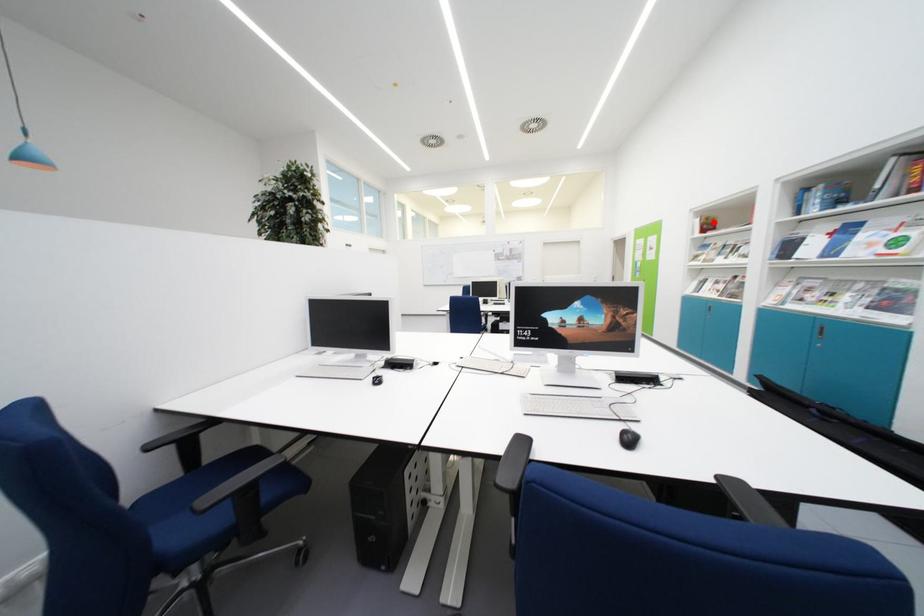
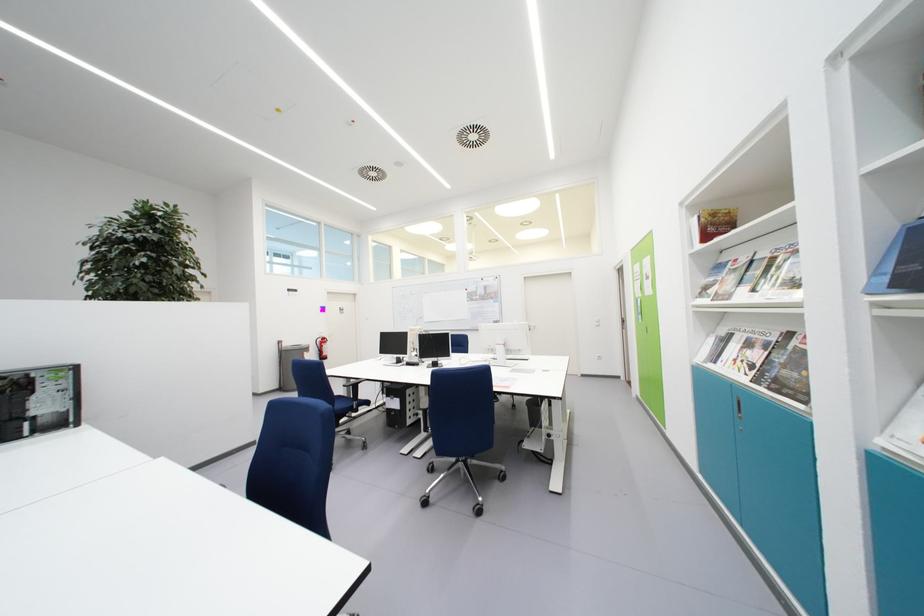
Where in the second image is the point corresponding to the highlighted location from the first image?

(720, 217)